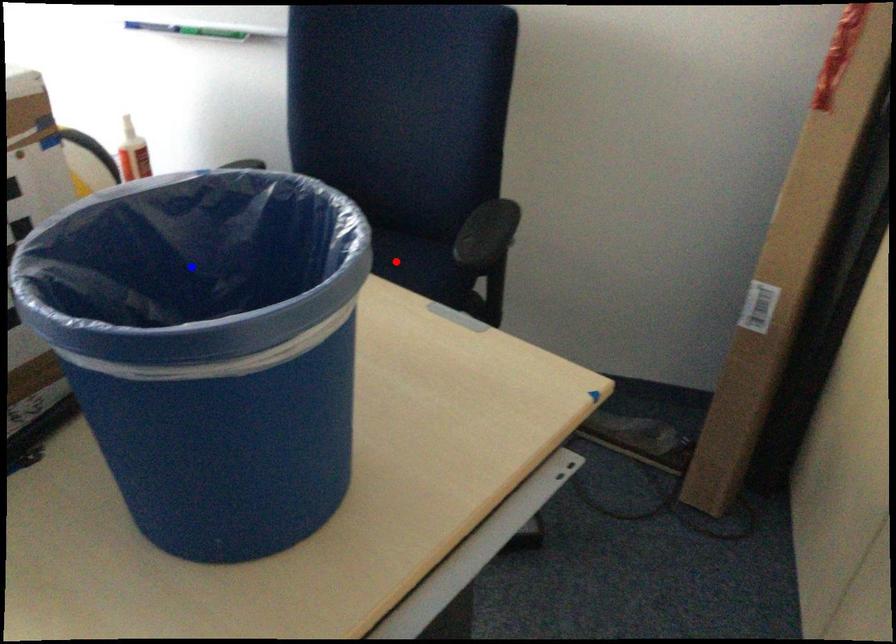
Question: In the image, two points are highlighted. Which point is nearer to the camera? Reply with the corresponding letter.

Choices:
 (A) blue point
 (B) red point

Answer: (A)